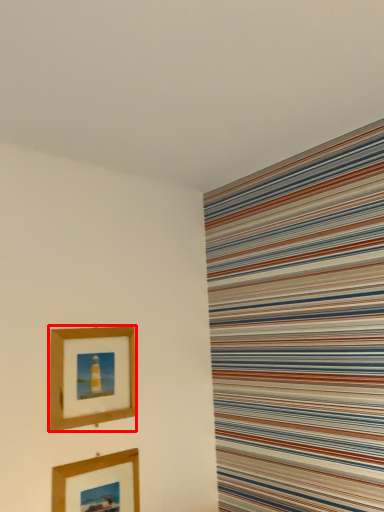
Question: From the image's perspective, where is picture frame (annotated by the red box) located relative to picture frame?

Choices:
 (A) above
 (B) below

Answer: (A)